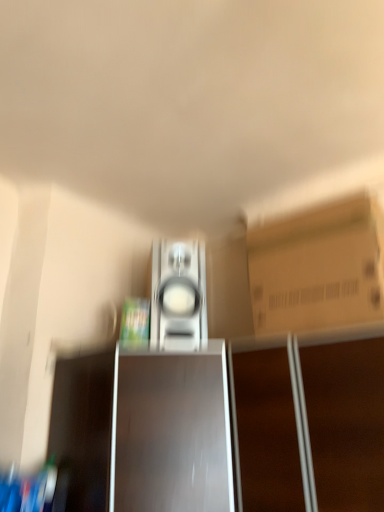
Question: Could you tell me if brown cardboard box at upper right is turned towards shiny brown cabinet at center?

Choices:
 (A) yes
 (B) no

Answer: (B)

Question: Is shiny brown cabinet at center surrounded by brown cardboard box at upper right?

Choices:
 (A) no
 (B) yes

Answer: (A)

Question: Does brown cardboard box at upper right touch shiny brown cabinet at center?

Choices:
 (A) no
 (B) yes

Answer: (A)

Question: Does brown cardboard box at upper right come in front of shiny brown cabinet at center?

Choices:
 (A) yes
 (B) no

Answer: (B)

Question: Is brown cardboard box at upper right thinner than shiny brown cabinet at center?

Choices:
 (A) yes
 (B) no

Answer: (A)

Question: Is shiny brown cabinet at center inside or outside of brown cardboard box at upper right?

Choices:
 (A) inside
 (B) outside

Answer: (B)

Question: From a real-world perspective, relative to brown cardboard box at upper right, is shiny brown cabinet at center vertically above or below?

Choices:
 (A) below
 (B) above

Answer: (A)

Question: Based on their sizes in the image, would you say shiny brown cabinet at center is bigger or smaller than brown cardboard box at upper right?

Choices:
 (A) big
 (B) small

Answer: (A)

Question: Relative to brown cardboard box at upper right, is shiny brown cabinet at center in front or behind?

Choices:
 (A) behind
 (B) front

Answer: (B)

Question: Considering the relative positions of satin silver speaker at center and brown cardboard box at upper right in the image provided, is satin silver speaker at center to the left or to the right of brown cardboard box at upper right?

Choices:
 (A) right
 (B) left

Answer: (B)

Question: In terms of size, does satin silver speaker at center appear bigger or smaller than brown cardboard box at upper right?

Choices:
 (A) big
 (B) small

Answer: (B)

Question: Considering their positions, is satin silver speaker at center located in front of or behind brown cardboard box at upper right?

Choices:
 (A) behind
 (B) front

Answer: (A)

Question: From their relative heights in the image, would you say satin silver speaker at center is taller or shorter than brown cardboard box at upper right?

Choices:
 (A) short
 (B) tall

Answer: (A)

Question: Is satin silver speaker at center wider or thinner than shiny brown cabinet at center?

Choices:
 (A) thin
 (B) wide

Answer: (A)

Question: Considering the relative positions of satin silver speaker at center and shiny brown cabinet at center in the image provided, is satin silver speaker at center to the left or to the right of shiny brown cabinet at center?

Choices:
 (A) left
 (B) right

Answer: (B)